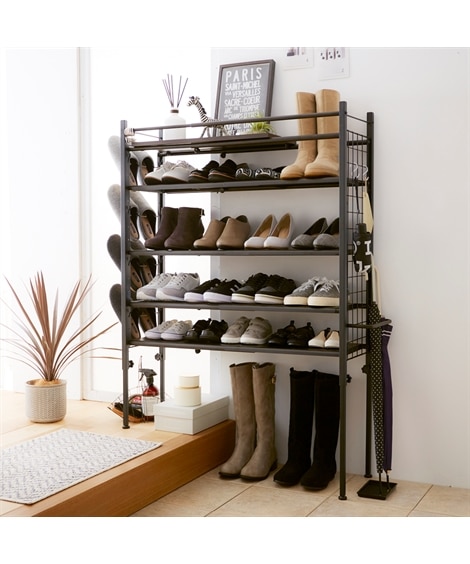
The width and height of the screenshot is (470, 564). I want to click on shoes hanging on shelf, so click(133, 164), click(143, 163), click(132, 212), click(142, 211), click(134, 268), click(145, 270), click(134, 321), click(145, 321).